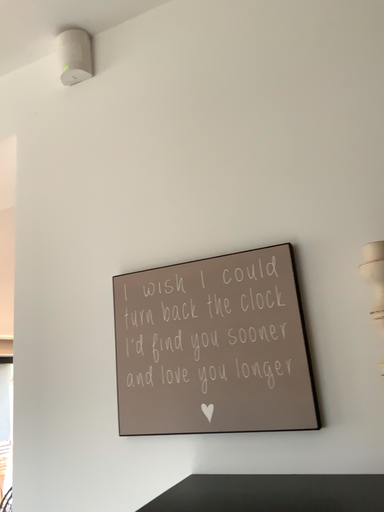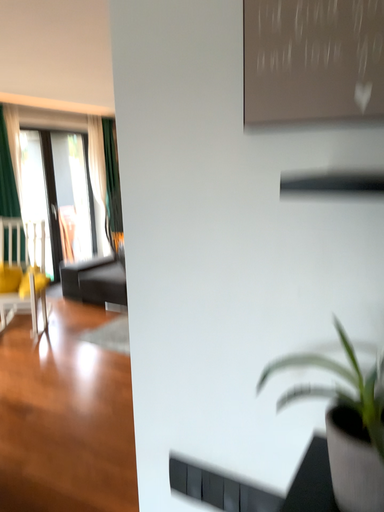
Question: Which way did the camera rotate in the video?

Choices:
 (A) rotated left
 (B) rotated right

Answer: (A)